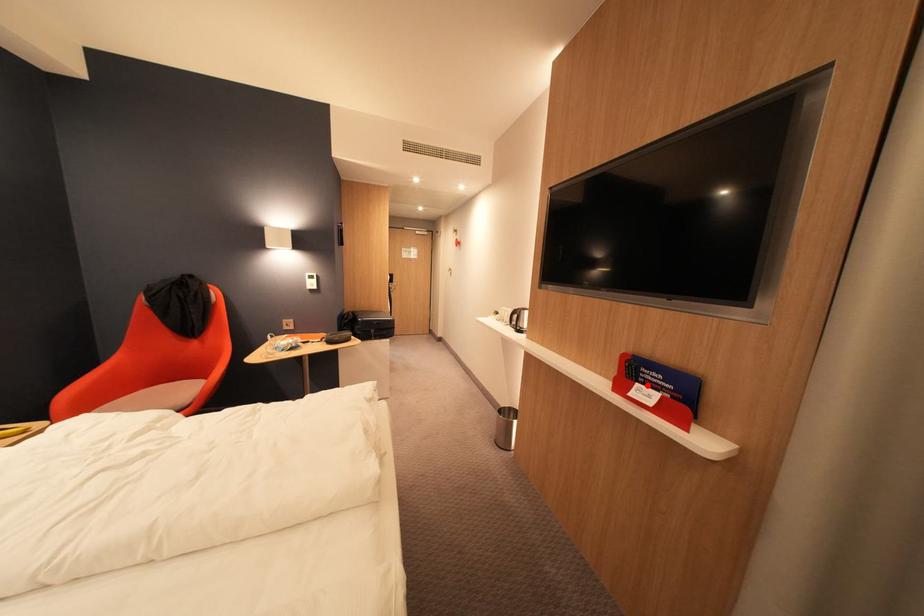
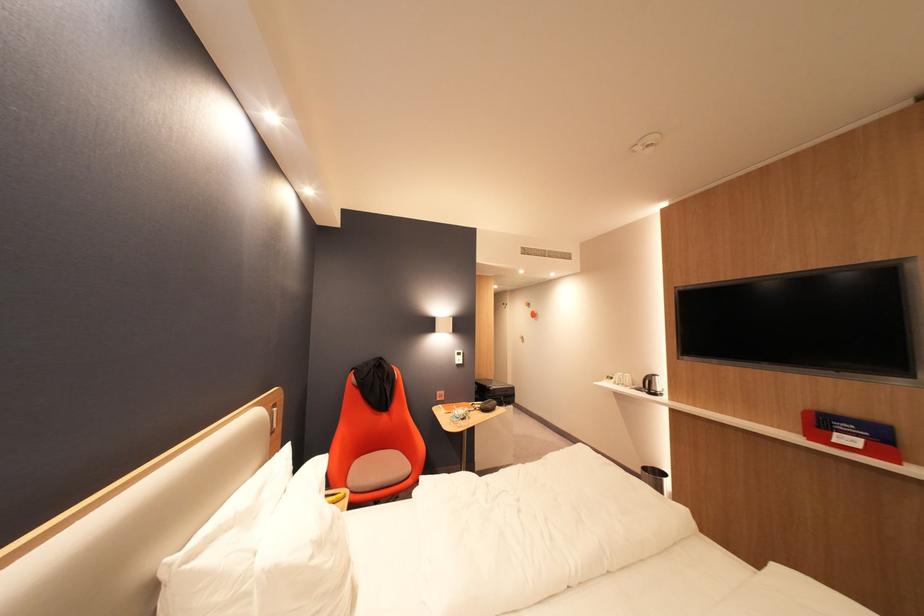
The point at the highlighted location is marked in the first image. Where is the corresponding point in the second image?

(846, 435)